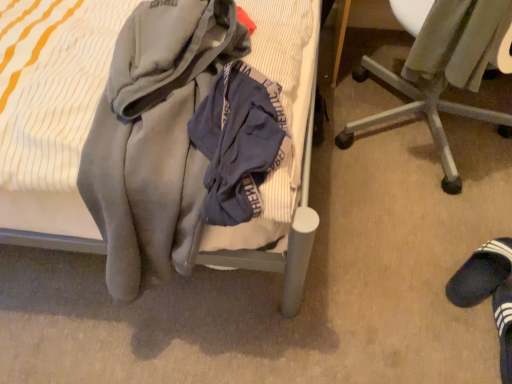
Question: Considering the relative sizes of metallic silver chair at lower right and black suede slipper at lower right in the image provided, is metallic silver chair at lower right bigger than black suede slipper at lower right?

Choices:
 (A) no
 (B) yes

Answer: (B)

Question: Is metallic silver chair at lower right touching black suede slipper at lower right?

Choices:
 (A) no
 (B) yes

Answer: (A)

Question: From the image's perspective, is metallic silver chair at lower right located beneath black suede slipper at lower right?

Choices:
 (A) no
 (B) yes

Answer: (A)

Question: Is metallic silver chair at lower right aimed at black suede slipper at lower right?

Choices:
 (A) no
 (B) yes

Answer: (A)

Question: Can you confirm if metallic silver chair at lower right is thinner than black suede slipper at lower right?

Choices:
 (A) yes
 (B) no

Answer: (B)

Question: From the image's perspective, is soft gray blanket at center located above or below metallic silver chair at lower right?

Choices:
 (A) below
 (B) above

Answer: (B)

Question: In the image, is soft gray blanket at center positioned in front of or behind metallic silver chair at lower right?

Choices:
 (A) front
 (B) behind

Answer: (A)

Question: From a real-world perspective, is soft gray blanket at center physically located above or below metallic silver chair at lower right?

Choices:
 (A) below
 (B) above

Answer: (B)

Question: Visually, is soft gray blanket at center positioned to the left or to the right of metallic silver chair at lower right?

Choices:
 (A) right
 (B) left

Answer: (B)

Question: Is metallic silver chair at lower right wider or thinner than velvet-like gray sweater at lower right?

Choices:
 (A) thin
 (B) wide

Answer: (B)

Question: Is metallic silver chair at lower right bigger or smaller than velvet-like gray sweater at lower right?

Choices:
 (A) big
 (B) small

Answer: (A)

Question: Is metallic silver chair at lower right spatially inside velvet-like gray sweater at lower right, or outside of it?

Choices:
 (A) outside
 (B) inside

Answer: (A)

Question: Considering the positions of point (434, 137) and point (403, 72), is point (434, 137) closer or farther from the camera than point (403, 72)?

Choices:
 (A) farther
 (B) closer

Answer: (A)

Question: Considering the positions of point (450, 288) and point (296, 306), is point (450, 288) closer or farther from the camera than point (296, 306)?

Choices:
 (A) closer
 (B) farther

Answer: (B)

Question: Relative to soft gray blanket at center, is black suede slipper at lower right in front or behind?

Choices:
 (A) front
 (B) behind

Answer: (B)